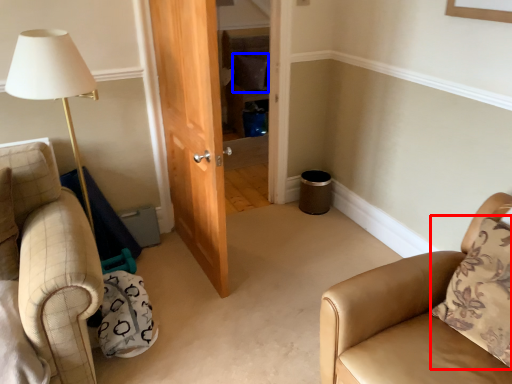
Question: Which point is further to the camera, pillow (highlighted by a red box) or pillow (highlighted by a blue box)?

Choices:
 (A) pillow
 (B) pillow

Answer: (B)